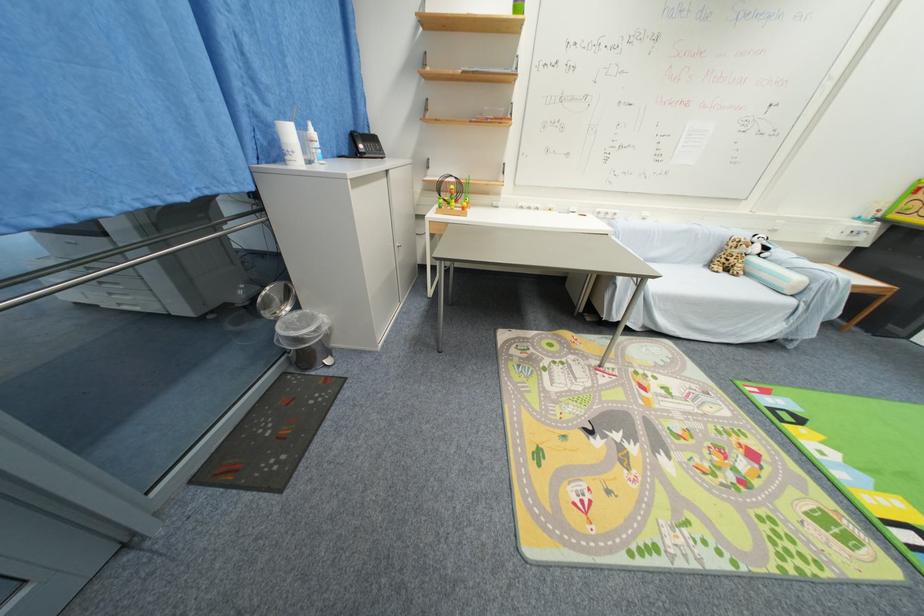
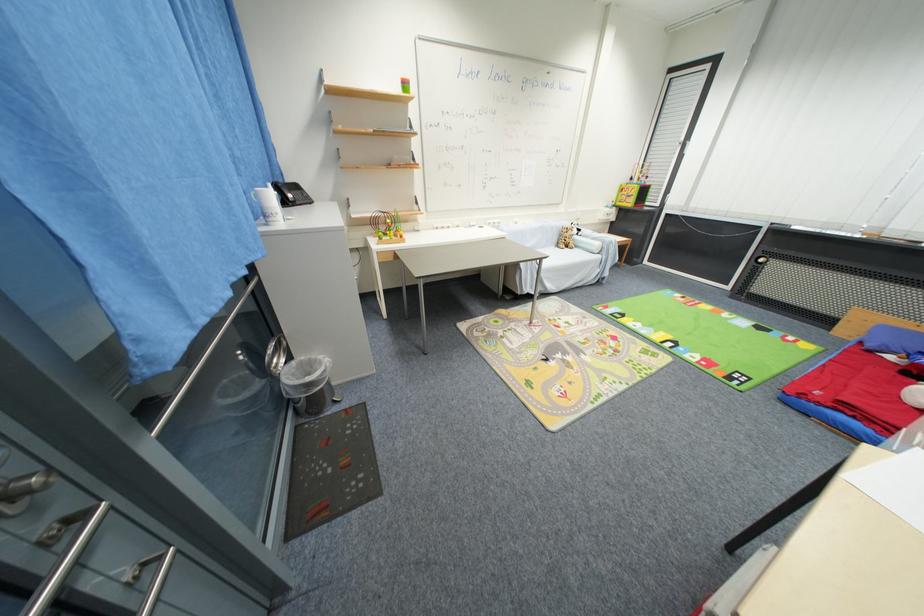
Where in the second image is the point corresponding to pixel 795 304 from the first image?

(603, 259)